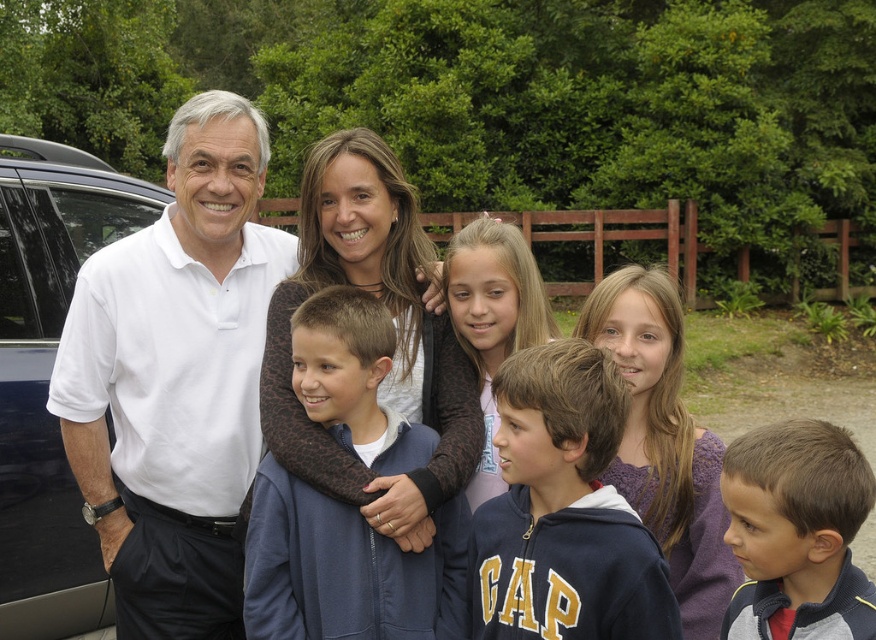
You are standing 3 meters away from the wooden fence in the background. There is a point marked at coordinates point [140,548]. Can you determine if this point is closer to you or farther away than the wooden fence?

The distance of point [140,548] from viewer is 3.11 meters, so the point is farther away than the wooden fence which is 3 meters away.

You are standing in front of the family photo and notice two points marked on the image. The first point is at coordinate point [181,296] and the second is at point [58,268]. Which of these two points is nearer to you?

Point [181,296] is closer to the viewer than point [58,268].